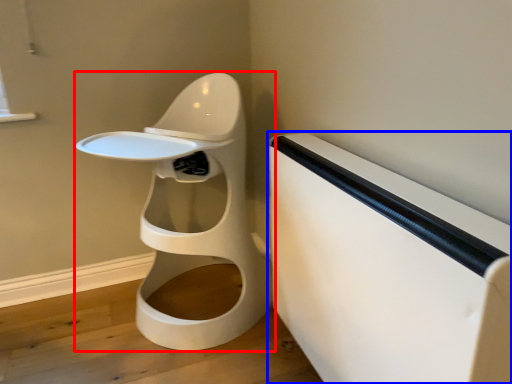
Question: Which of the following is the closest to the observer, toilet (highlighted by a red box) or changing table (highlighted by a blue box)?

Choices:
 (A) toilet
 (B) changing table

Answer: (B)